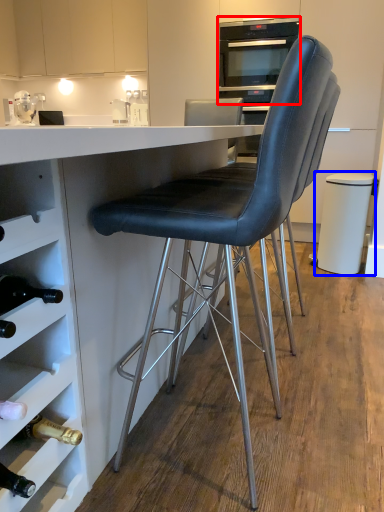
Question: Which object appears farthest to the camera in this image, home appliance (highlighted by a red box) or bar stool (highlighted by a blue box)?

Choices:
 (A) home appliance
 (B) bar stool

Answer: (A)